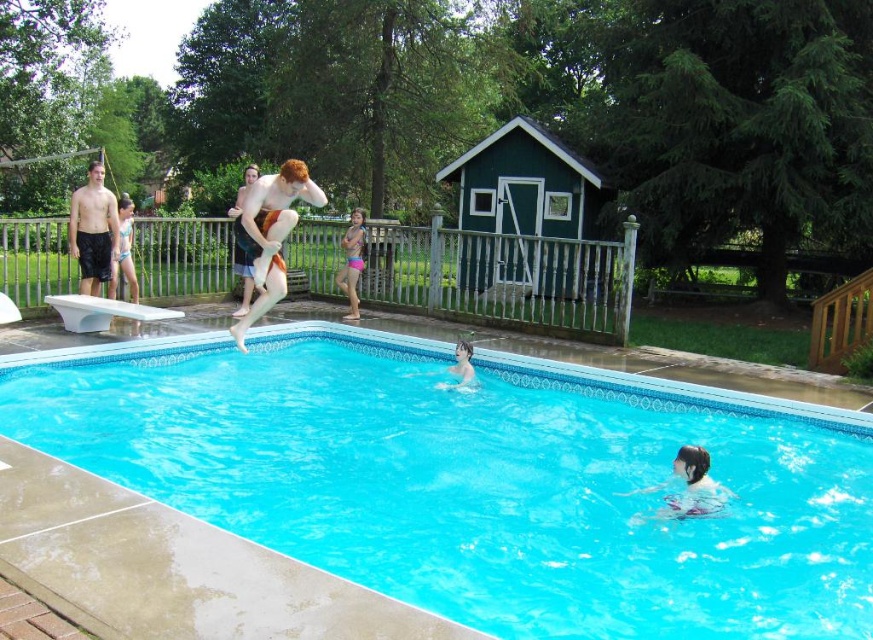
Question: Does blue glossy water at center have a greater width compared to smooth skin man at upper center?

Choices:
 (A) yes
 (B) no

Answer: (B)

Question: Does blue glossy water at center lie in front of smooth tan skin at upper center?

Choices:
 (A) no
 (B) yes

Answer: (B)

Question: Among these objects, which one is nearest to the camera?

Choices:
 (A) blue glossy water at center
 (B) matte black shorts at left
 (C) smooth skin man at upper center

Answer: (A)

Question: Does blue glossy water at center appear over smooth tan skin at upper center?

Choices:
 (A) yes
 (B) no

Answer: (B)

Question: Considering the real-world distances, which object is closest to the smooth tan skin at upper center?

Choices:
 (A) blue glossy water at center
 (B) matte black shorts at left

Answer: (B)

Question: Which of the following is the closest to the observer?

Choices:
 (A) smooth tan skin at upper center
 (B) matte black shorts at left

Answer: (A)